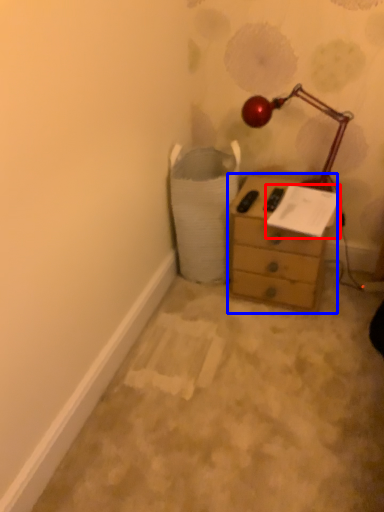
Question: Which object is further to the camera taking this photo, paper (highlighted by a red box) or chest of drawers (highlighted by a blue box)?

Choices:
 (A) paper
 (B) chest of drawers

Answer: (B)